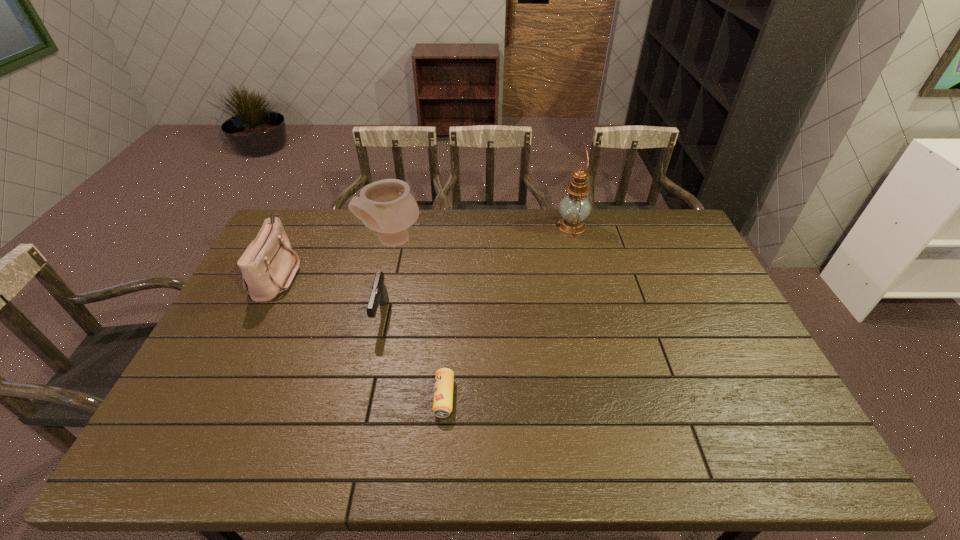
Locate an element on the screen. The width and height of the screenshot is (960, 540). oil lamp is located at coordinates (574, 208).

Locate an element on the screen. The height and width of the screenshot is (540, 960). the tallest object is located at coordinates (574, 208).

At what (x,y) coordinates should I click in order to perform the action: click on pottery. Please return your answer as a coordinate pair (x, y). This screenshot has height=540, width=960. Looking at the image, I should click on point(386,206).

Where is `shoulder bag`? This screenshot has width=960, height=540. shoulder bag is located at coordinates (268, 265).

Find the location of `the leftmost object`. the leftmost object is located at coordinates (268, 265).

Where is `pistol`? The height and width of the screenshot is (540, 960). pistol is located at coordinates (379, 295).

Where is `the shortest object`? This screenshot has width=960, height=540. the shortest object is located at coordinates (444, 378).

The height and width of the screenshot is (540, 960). Find the location of `the second object from right to left`. the second object from right to left is located at coordinates pyautogui.click(x=444, y=378).

This screenshot has height=540, width=960. Find the location of `free space located 0.060m on the front of the tallest object`. free space located 0.060m on the front of the tallest object is located at coordinates tap(578, 250).

What are the coordinates of `free space located 0.050m on the right of the pottery` in the screenshot? It's located at (435, 241).